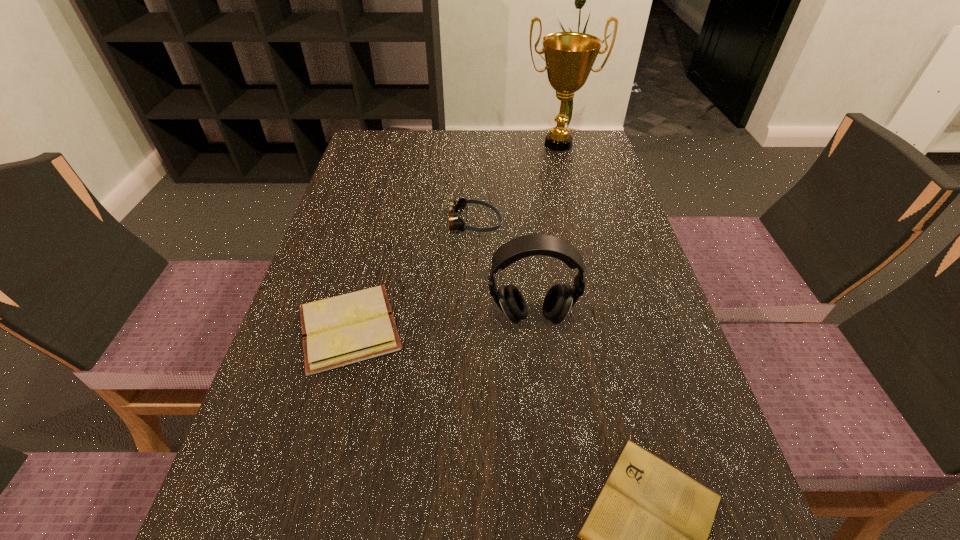
This screenshot has height=540, width=960. What are the coordinates of `vacant point located between the fourth nearest object and the diary` in the screenshot? It's located at (411, 275).

The width and height of the screenshot is (960, 540). I want to click on vacant area that lies between the third tallest object and the leftmost object, so click(411, 275).

What are the coordinates of `empty location between the fourth nearest object and the award` in the screenshot? It's located at (516, 184).

You are a GUI agent. You are given a task and a screenshot of the screen. Output one action in this format:
    pyautogui.click(x=<x>, y=<y>)
    Task: Click on the free space between the tallest object and the diary
    The image size is (960, 540).
    Given the screenshot: What is the action you would take?
    pyautogui.click(x=454, y=236)

You are a GUI agent. You are given a task and a screenshot of the screen. Output one action in this format:
    pyautogui.click(x=<x>, y=<y>)
    Task: Click on the vacant region between the leftmost object and the goggles
    This screenshot has height=540, width=960.
    Given the screenshot: What is the action you would take?
    pyautogui.click(x=411, y=275)

The width and height of the screenshot is (960, 540). In order to click on free space between the second farthest object and the award in this screenshot , I will do `click(516, 184)`.

The width and height of the screenshot is (960, 540). Identify the location of the second closest object to the goggles. (558, 301).

Locate an element on the screen. object that stands as the fourth closest to the book is located at coordinates (569, 56).

You are a GUI agent. You are given a task and a screenshot of the screen. Output one action in this format:
    pyautogui.click(x=<x>, y=<y>)
    Task: Click on the vacant region that satisfies the following two spatial constraints: 1. through the lenses of the third tallest object; 2. on the front side of the second shortest object
    
    Given the screenshot: What is the action you would take?
    pyautogui.click(x=471, y=328)